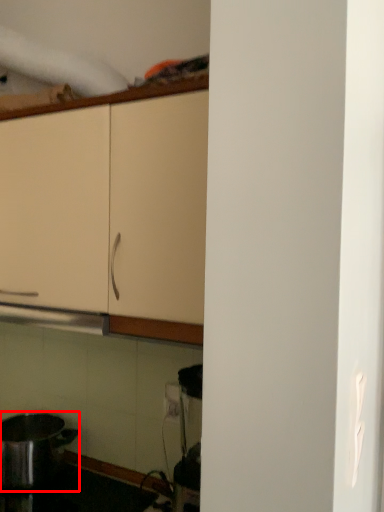
Question: Observing the image, what is the correct spatial positioning of kitchen appliance (annotated by the red box) in reference to cabinetry?

Choices:
 (A) right
 (B) left

Answer: (B)